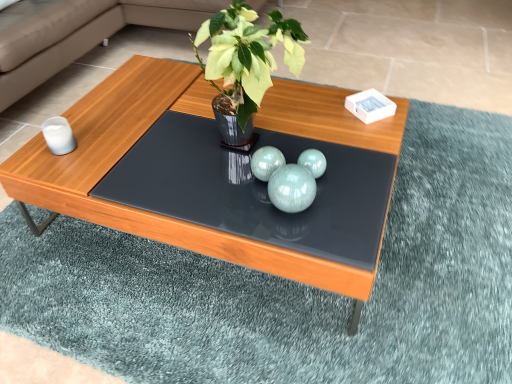
Find the location of a particular element. vacant space to the right of matte wooden coffee table at center is located at coordinates (444, 218).